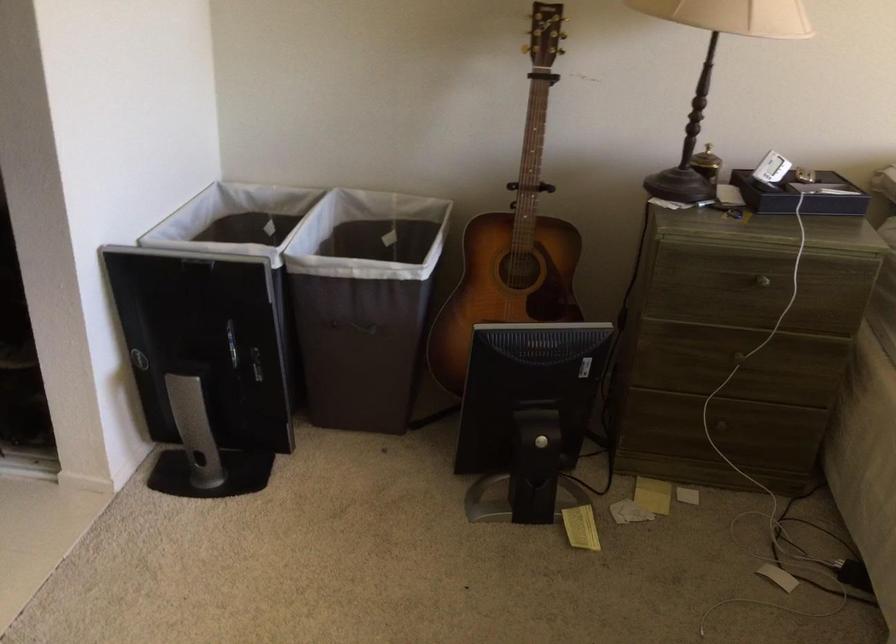
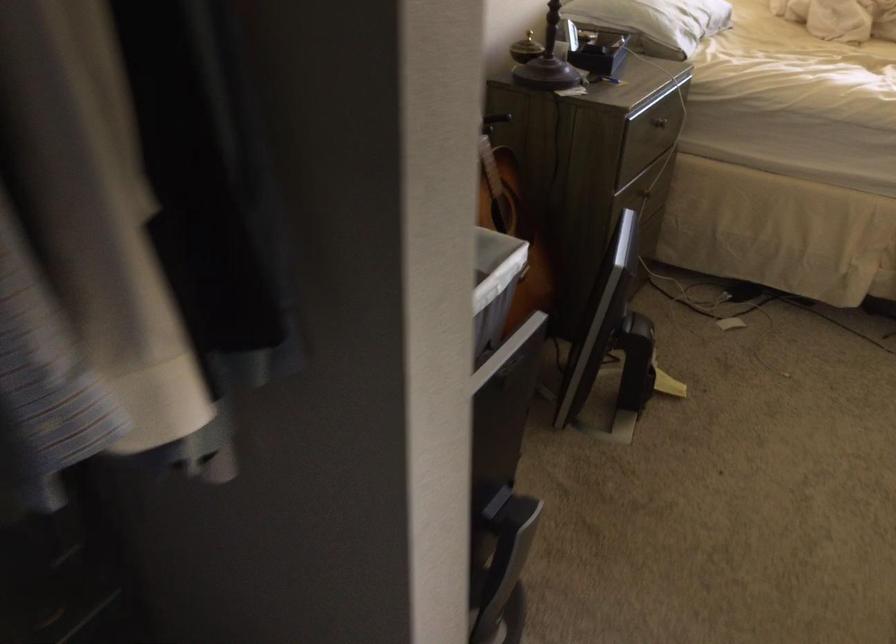
Locate, in the second image, the point that corresponds to (x=759, y=277) in the first image.

(659, 122)